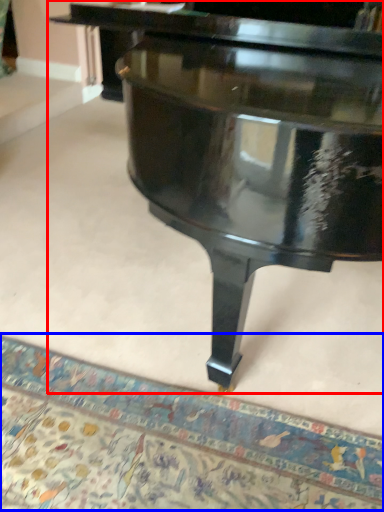
Question: Which object is further to the camera taking this photo, piano (highlighted by a red box) or mat (highlighted by a blue box)?

Choices:
 (A) piano
 (B) mat

Answer: (B)